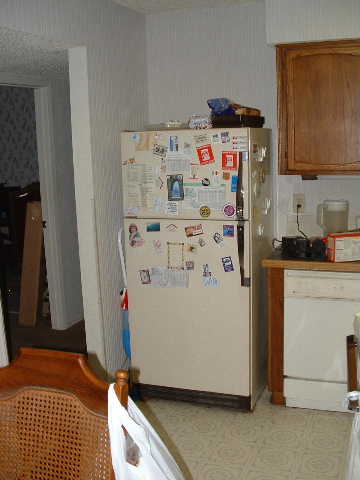
I want to click on wooden kitchen chair, so click(x=33, y=362).